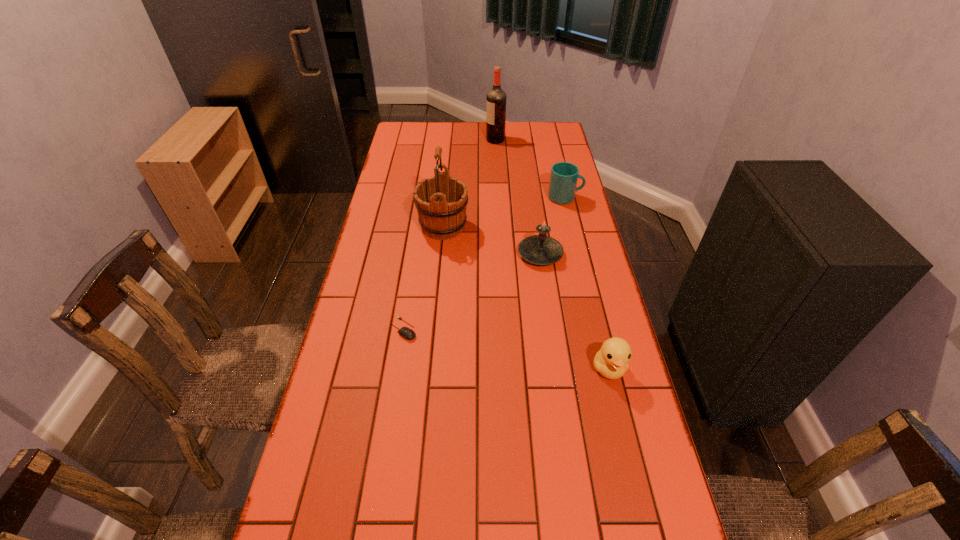
Locate an element on the screen. vacant point located 0.140m on the front-facing side of the farthest object is located at coordinates (455, 140).

The width and height of the screenshot is (960, 540). Find the location of `vacant space located on the right of the wine bucket`. vacant space located on the right of the wine bucket is located at coordinates (519, 226).

Identify the location of vacant space situated 0.280m on the left of the candle. (433, 254).

The image size is (960, 540). Find the location of `vacant point located on the face of the nearest object`. vacant point located on the face of the nearest object is located at coordinates coord(647,525).

The height and width of the screenshot is (540, 960). I want to click on vacant area located on the front of the shortest object, so click(394, 394).

Identify the location of object that is at the far edge. The width and height of the screenshot is (960, 540). (496, 98).

Find the location of a particular element. This screenshot has height=540, width=960. object located in the left edge section of the desktop is located at coordinates (405, 332).

At what (x,y) coordinates should I click in order to perform the action: click on candle at the right edge. Please return your answer as a coordinate pair (x, y). The image size is (960, 540). Looking at the image, I should click on (541, 249).

This screenshot has width=960, height=540. I want to click on cup present at the right edge, so click(x=563, y=179).

Where is `duck present at the right edge`? Image resolution: width=960 pixels, height=540 pixels. duck present at the right edge is located at coordinates (611, 361).